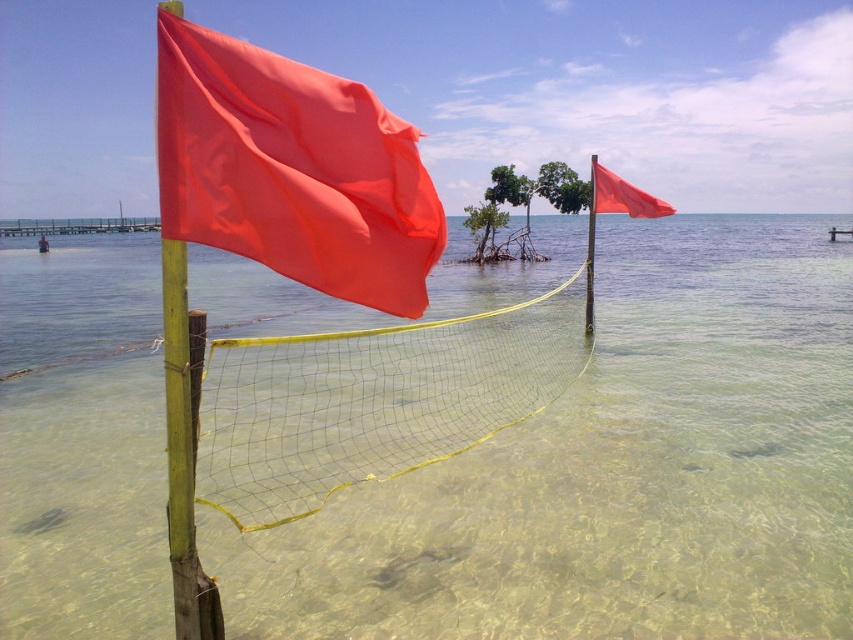
Which of these two, yellow mesh net at center or matte orange flag at upper right, stands shorter?

Standing shorter between the two is matte orange flag at upper right.

Does yellow mesh net at center appear on the right side of matte orange flag at upper right?

In fact, yellow mesh net at center is to the left of matte orange flag at upper right.

The height and width of the screenshot is (640, 853). Describe the element at coordinates (373, 401) in the screenshot. I see `yellow mesh net at center` at that location.

Find the location of a particular element. Image resolution: width=853 pixels, height=640 pixels. yellow mesh net at center is located at coordinates point(373,401).

Is point (210, 44) positioned in front of point (445, 378)?

Yes.

Is point (375, 269) farther from camera compared to point (392, 364)?

No, it is in front of (392, 364).

Who is more forward, (322, 211) or (482, 419)?

Positioned in front is point (322, 211).

Locate an element on the screen. matte fabric flag at center is located at coordinates click(x=291, y=170).

In order to click on clear water at center in this screenshot , I will do `click(613, 472)`.

How far apart are clear water at center and matte fabric flag at center?

43.05 feet

Who is more forward, (665, 436) or (384, 259)?

Point (384, 259)

The height and width of the screenshot is (640, 853). In order to click on clear water at center in this screenshot , I will do 613,472.